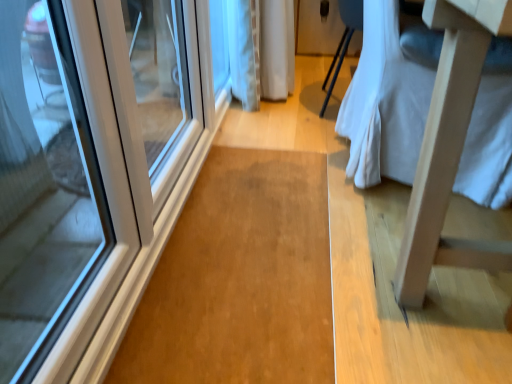
Question: Is light wood changing table at right inside or outside of white glossy door at left?

Choices:
 (A) inside
 (B) outside

Answer: (B)

Question: Is light wood changing table at right bigger or smaller than white glossy door at left?

Choices:
 (A) small
 (B) big

Answer: (B)

Question: Is light wood changing table at right in front of or behind white glossy door at left in the image?

Choices:
 (A) behind
 (B) front

Answer: (B)

Question: From a real-world perspective, is white glossy door at left above or below light wood changing table at right?

Choices:
 (A) above
 (B) below

Answer: (B)

Question: Based on their sizes in the image, would you say white glossy door at left is bigger or smaller than light wood changing table at right?

Choices:
 (A) big
 (B) small

Answer: (B)

Question: From the image's perspective, is white glossy door at left located above or below light wood changing table at right?

Choices:
 (A) above
 (B) below

Answer: (B)

Question: Is white glossy door at left in front of or behind light wood changing table at right in the image?

Choices:
 (A) behind
 (B) front

Answer: (A)